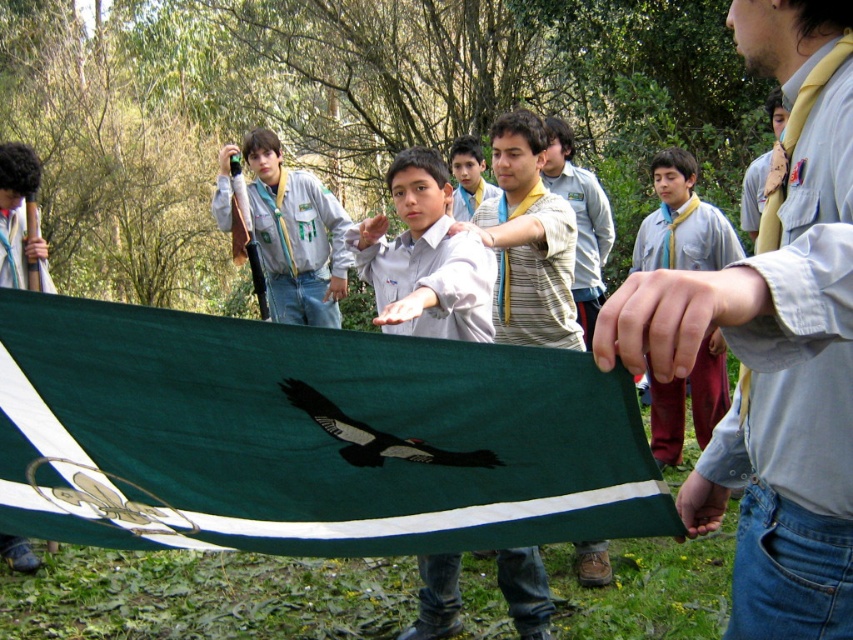
Is point (161, 534) in front of point (722, 397)?

Yes, it is.

The width and height of the screenshot is (853, 640). Describe the element at coordinates (306, 436) in the screenshot. I see `green fabric flag at center` at that location.

You are a GUI agent. You are given a task and a screenshot of the screen. Output one action in this format:
    pyautogui.click(x=<x>, y=<y>)
    Task: Click on the green fabric flag at center
    The image size is (853, 640).
    Given the screenshot: What is the action you would take?
    pyautogui.click(x=306, y=436)

Is matte yellow tie at center to the left of dark brown glossy eagle at center from the viewer's perspective?

In fact, matte yellow tie at center is to the right of dark brown glossy eagle at center.

Measure the distance between matte yellow tie at center and camera.

matte yellow tie at center is 30.73 inches from camera.

Locate an element on the screen. The width and height of the screenshot is (853, 640). matte yellow tie at center is located at coordinates (775, 346).

Is point (436, 388) closer to camera compared to point (737, 305)?

That is False.

Describe the element at coordinates (306, 436) in the screenshot. I see `green fabric flag at center` at that location.

Where is `green fabric flag at center`? Image resolution: width=853 pixels, height=640 pixels. green fabric flag at center is located at coordinates (306, 436).